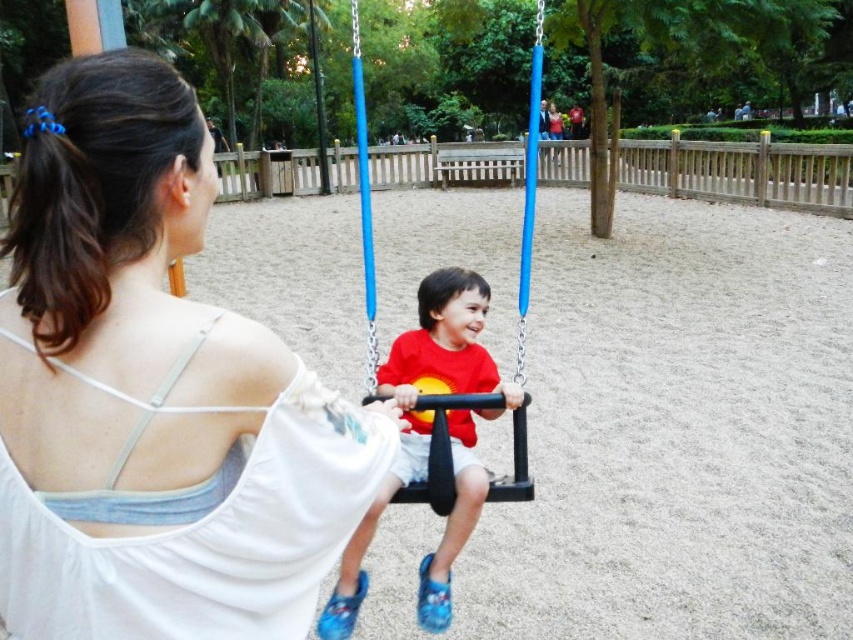
Question: Observing the image, what is the correct spatial positioning of white fabric at center in reference to matte plastic swing at center?

Choices:
 (A) right
 (B) left

Answer: (B)

Question: Which point is closer to the camera taking this photo?

Choices:
 (A) (520, 449)
 (B) (103, 164)

Answer: (B)

Question: Among these objects, which one is nearest to the camera?

Choices:
 (A) red matte shirt at center
 (B) white fabric at center

Answer: (B)

Question: Which point is closer to the camera?

Choices:
 (A) red matte shirt at center
 (B) white fabric at center
 (C) matte plastic swing at center

Answer: (B)

Question: Does white fabric at center appear on the right side of red matte shirt at center?

Choices:
 (A) no
 (B) yes

Answer: (A)

Question: Does red matte shirt at center appear on the right side of matte plastic swing at center?

Choices:
 (A) yes
 (B) no

Answer: (B)